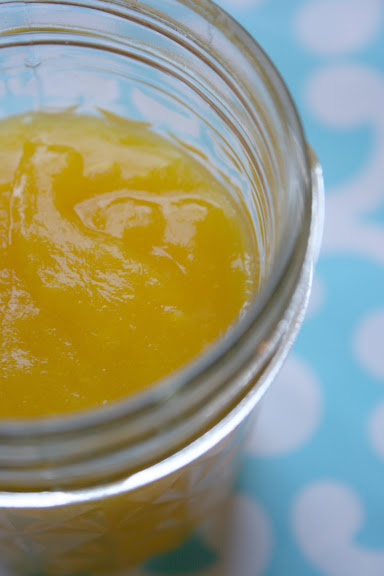
The width and height of the screenshot is (384, 576). Find the location of `corner`. corner is located at coordinates (8, 564), (373, 564), (376, 12), (6, 3).